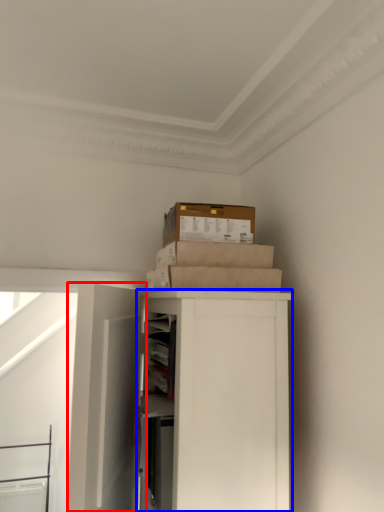
Question: Which of the following is the farthest to the observer, door (highlighted by a red box) or cabinetry (highlighted by a blue box)?

Choices:
 (A) door
 (B) cabinetry

Answer: (B)